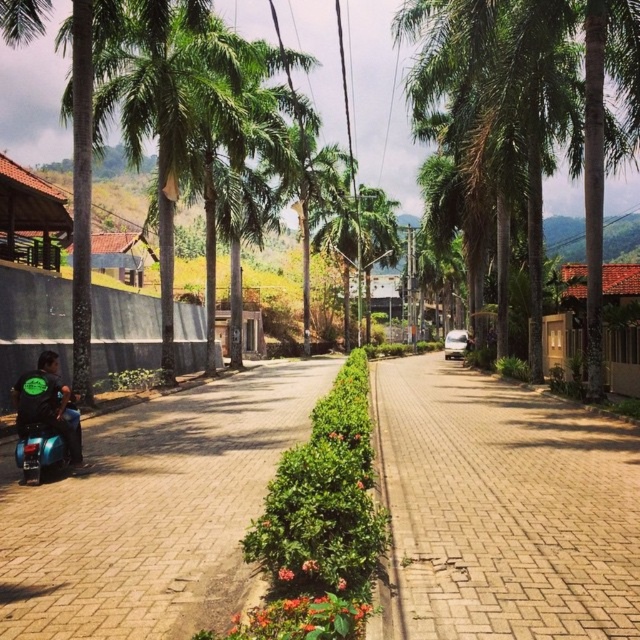
You are a delivery person who needs to cross the brick paved road at center while avoiding the dark green fabric motorcyclist at lower left. What is the minimum distance you need to move away from the motorcyclist to safely cross the road?

The brick paved road at center and dark green fabric motorcyclist at lower left are 6.84 meters apart from each other. To safely cross the road, you need to move at least 6.84 meters away from the motorcyclist.

You are standing at the entrance of the street scene and want to walk towards the brick paved road at center. According to the coordinates provided, in which direction should you move relative to your current position?

The brick paved road at center is located at coordinates point (504,508). Since you are at the entrance, you should move forward towards the center of the scene to reach it.

You are a pedestrian standing on the sidewalk and want to cross the road to the other side. You see a blue glossy scooter at lower left and a dark green fabric motorcyclist at lower left. Which object is closer to you, the pedestrian?

The blue glossy scooter at lower left is positioned under the dark green fabric motorcyclist at lower left, so the dark green fabric motorcyclist at lower left is closer to you.